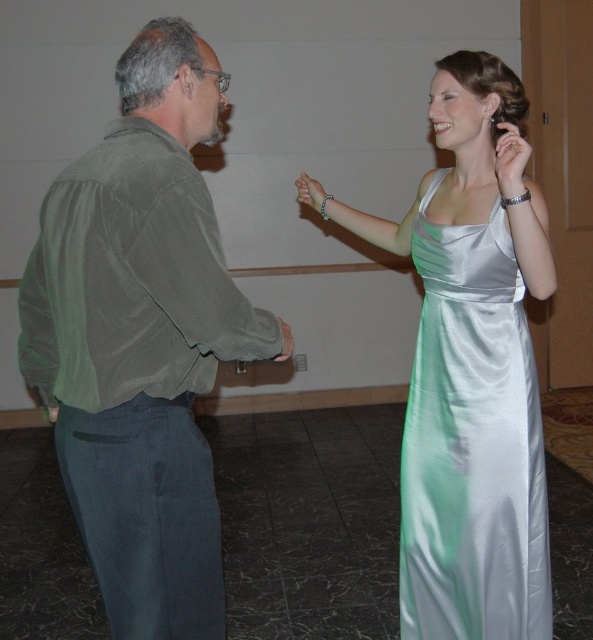
Question: Does green satin shirt at left appear over silky silver dress at right?

Choices:
 (A) yes
 (B) no

Answer: (A)

Question: Which point is farther from the camera taking this photo?

Choices:
 (A) [x=502, y=253]
 (B) [x=142, y=109]

Answer: (A)

Question: Is satin dress at right wider than silky silver dress at right?

Choices:
 (A) yes
 (B) no

Answer: (A)

Question: Is green satin shirt at left further to camera compared to silky silver dress at right?

Choices:
 (A) no
 (B) yes

Answer: (A)

Question: Estimate the real-world distances between objects in this image. Which object is farther from the silky silver dress at right?

Choices:
 (A) green satin shirt at left
 (B) satin dress at right

Answer: (A)

Question: Which is farther from the green satin shirt at left?

Choices:
 (A) satin dress at right
 (B) silky silver dress at right

Answer: (A)